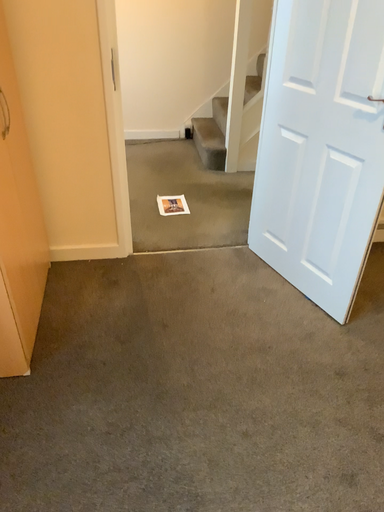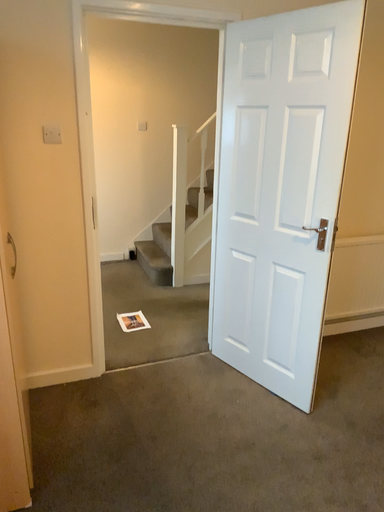
Question: How did the camera likely rotate when shooting the video?

Choices:
 (A) rotated left
 (B) rotated right

Answer: (B)